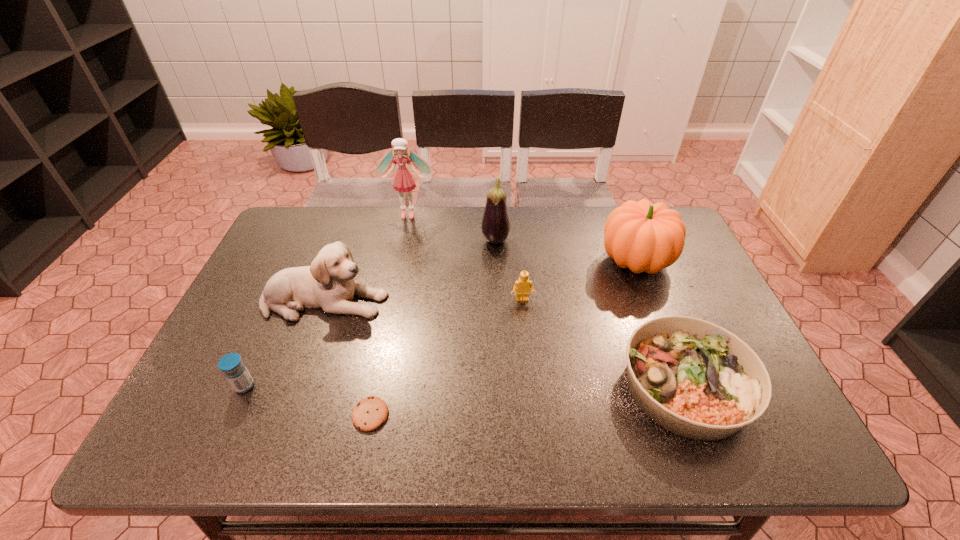
Where is `vacant space that satisfies the following two spatial constraints: 1. on the back side of the shortest object; 2. on the front-facing side of the puppy`? Image resolution: width=960 pixels, height=540 pixels. vacant space that satisfies the following two spatial constraints: 1. on the back side of the shortest object; 2. on the front-facing side of the puppy is located at coordinates (394, 301).